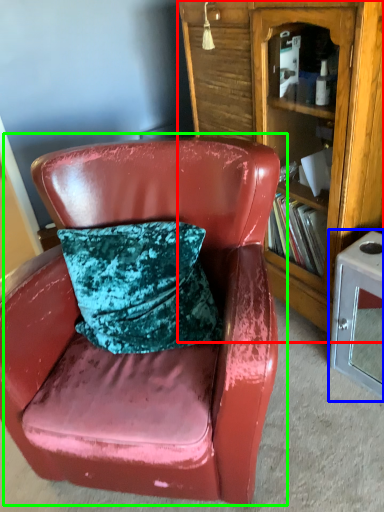
Question: Which object is the farthest from bookcase (highlighted by a red box)? Choose among these: table (highlighted by a blue box) or chair (highlighted by a green box).

Choices:
 (A) table
 (B) chair

Answer: (B)